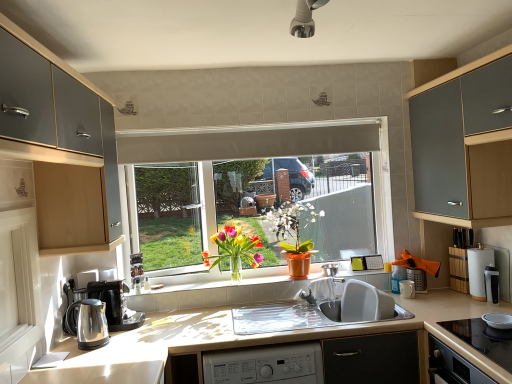
Question: Is brushed metal cabinet at left, positioned as the first cabinetry in left-to-right order, bigger than matte white window at center?

Choices:
 (A) no
 (B) yes

Answer: (B)

Question: Would you say brushed metal cabinet at left, positioned as the first cabinetry in left-to-right order, is outside matte white window at center?

Choices:
 (A) yes
 (B) no

Answer: (A)

Question: From a real-world perspective, is brushed metal cabinet at left, positioned as the first cabinetry in left-to-right order, positioned over matte white window at center based on gravity?

Choices:
 (A) no
 (B) yes

Answer: (B)

Question: Can you confirm if brushed metal cabinet at left, the second cabinetry positioned from the right, is wider than matte white window at center?

Choices:
 (A) yes
 (B) no

Answer: (A)

Question: From the image's perspective, is brushed metal cabinet at left, the second cabinetry positioned from the right, on matte white window at center?

Choices:
 (A) yes
 (B) no

Answer: (A)

Question: Is brushed metal cabinet at left, the second cabinetry positioned from the right, at the right side of matte white window at center?

Choices:
 (A) yes
 (B) no

Answer: (B)

Question: From a real-world perspective, is polished stainless steel kettle at lower left over matte silver utensil holder at right, marked as the 4th appliance in a front-to-back arrangement?

Choices:
 (A) yes
 (B) no

Answer: (A)

Question: Does polished stainless steel kettle at lower left appear on the right side of matte silver utensil holder at right, the second appliance in the back-to-front sequence?

Choices:
 (A) yes
 (B) no

Answer: (B)

Question: Is polished stainless steel kettle at lower left thinner than matte silver utensil holder at right, the second appliance in the back-to-front sequence?

Choices:
 (A) no
 (B) yes

Answer: (A)

Question: From the image's perspective, is polished stainless steel kettle at lower left below matte silver utensil holder at right, the second appliance in the back-to-front sequence?

Choices:
 (A) no
 (B) yes

Answer: (B)

Question: Considering the relative sizes of polished stainless steel kettle at lower left and matte silver utensil holder at right, which is the third appliance in right-to-left order, in the image provided, is polished stainless steel kettle at lower left smaller than matte silver utensil holder at right, which is the third appliance in right-to-left order,?

Choices:
 (A) no
 (B) yes

Answer: (A)

Question: Does polished stainless steel kettle at lower left come in front of matte silver utensil holder at right, which is the third appliance in right-to-left order?

Choices:
 (A) yes
 (B) no

Answer: (A)

Question: Is metallic silver pot at center, placed as the 1th appliance when sorted from left to right, not close to white glossy screen door at left?

Choices:
 (A) no
 (B) yes

Answer: (B)